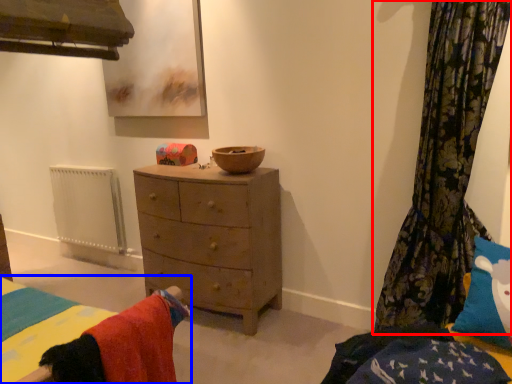
Question: Among these objects, which one is nearest to the camera, curtain (highlighted by a red box) or bed (highlighted by a blue box)?

Choices:
 (A) curtain
 (B) bed

Answer: (B)